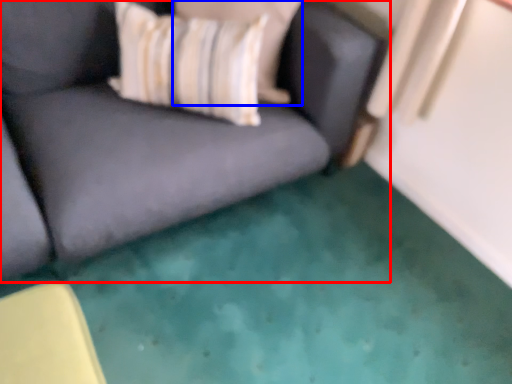
Question: Which object is further to the camera taking this photo, studio couch (highlighted by a red box) or pillow (highlighted by a blue box)?

Choices:
 (A) studio couch
 (B) pillow

Answer: (B)